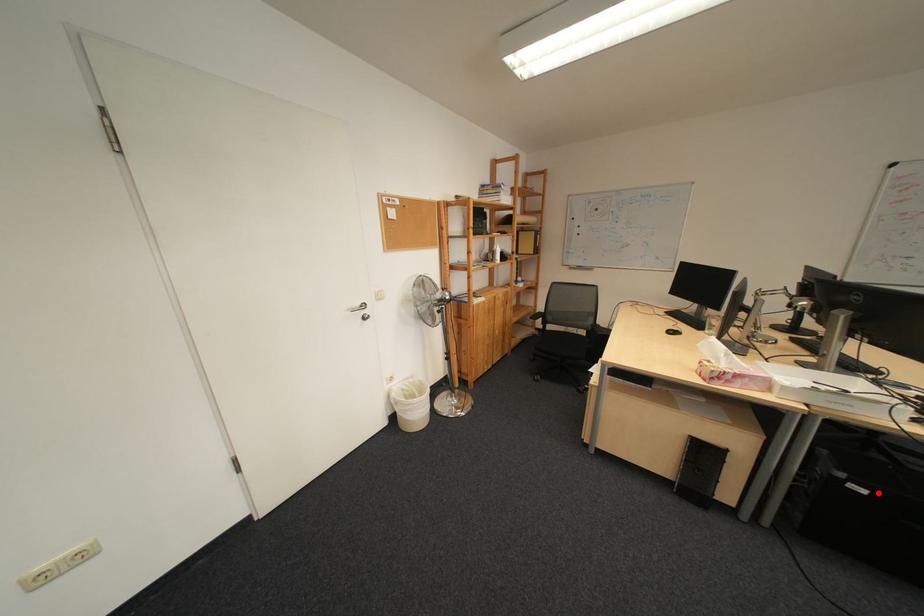
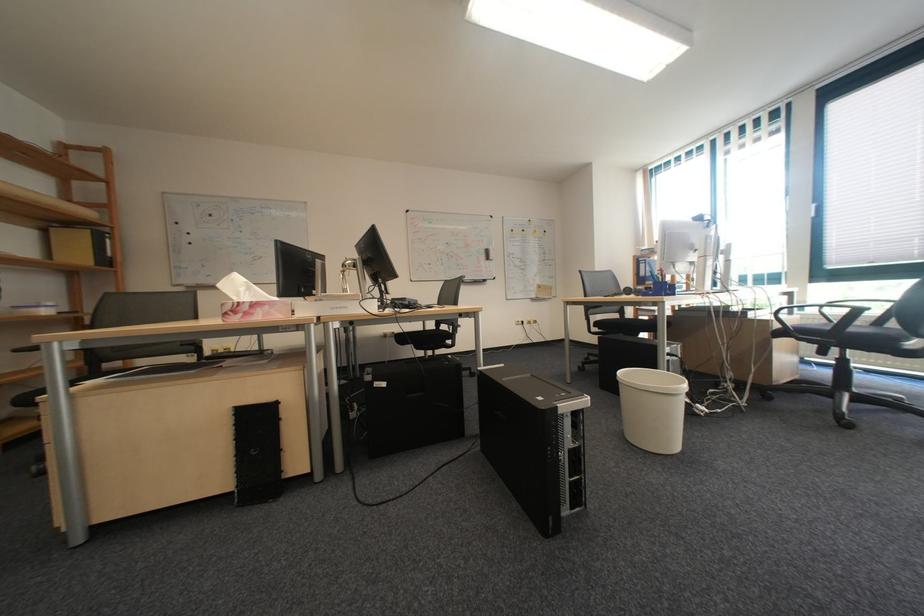
In the second image, find the point that corresponds to the highlighted location in the first image.

(398, 386)